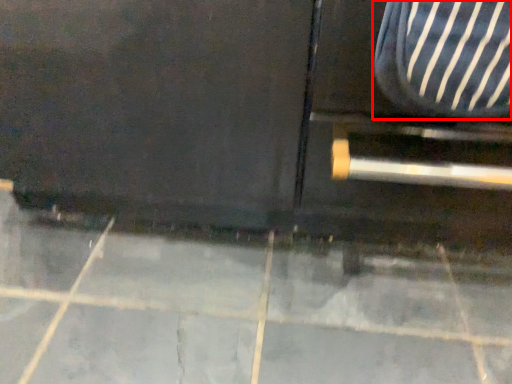
Question: Where is armchair (annotated by the red box) located in relation to concrete in the image?

Choices:
 (A) right
 (B) left

Answer: (A)